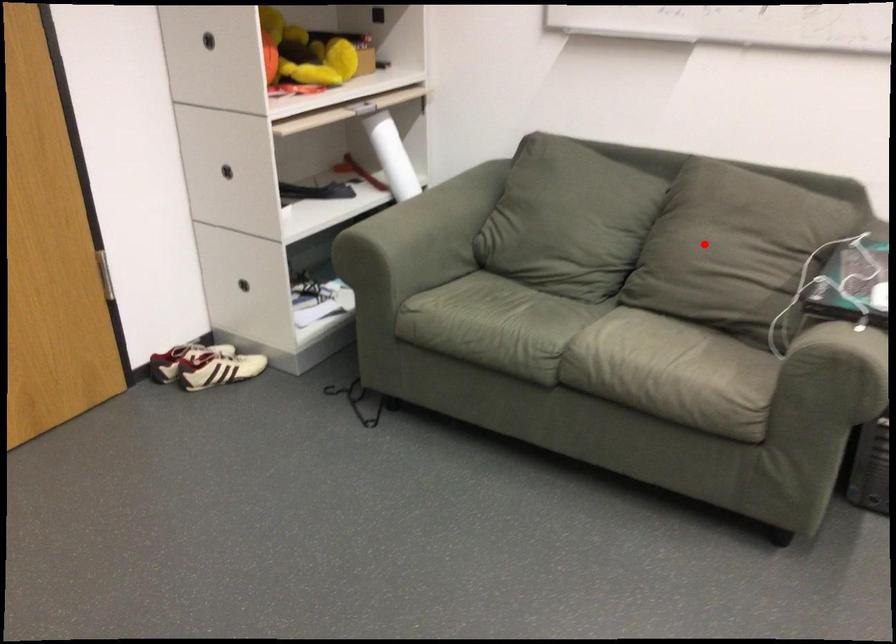
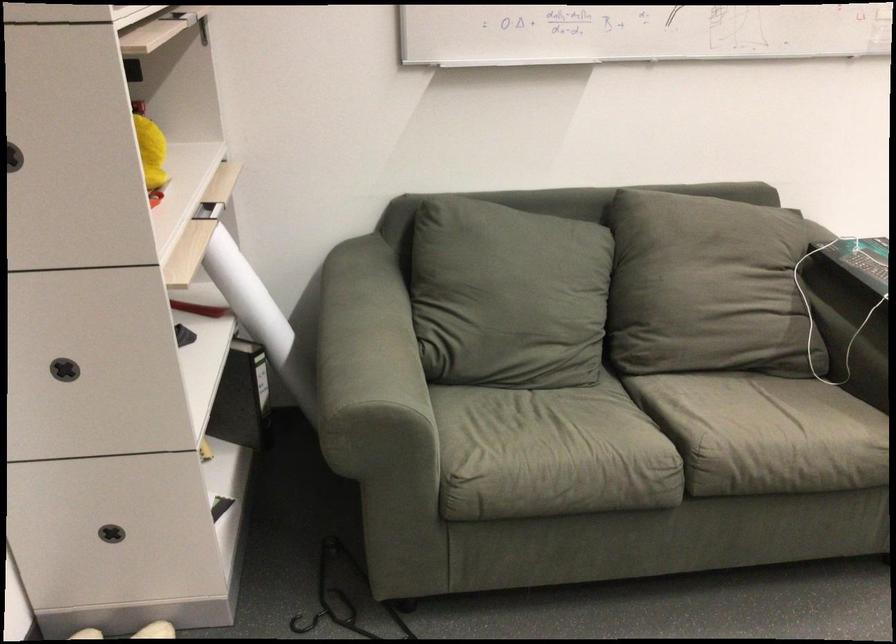
Question: I am providing you with two images of the same scene from different viewpoints. Given a red point in image1, look at the same physical point in image2. Is it:

Choices:
 (A) Closer to the viewpoint
 (B) Farther from the viewpoint

Answer: (A)